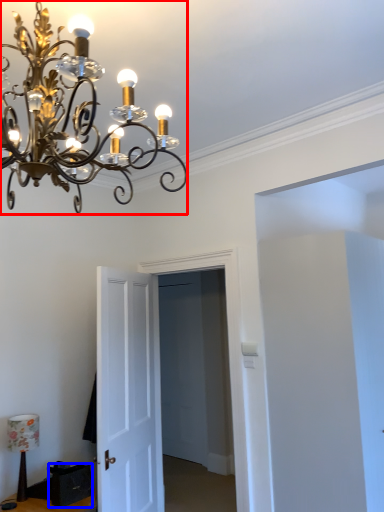
Question: Which of the following is the farthest to the observer, lamp (highlighted by a red box) or drawer (highlighted by a blue box)?

Choices:
 (A) lamp
 (B) drawer

Answer: (B)